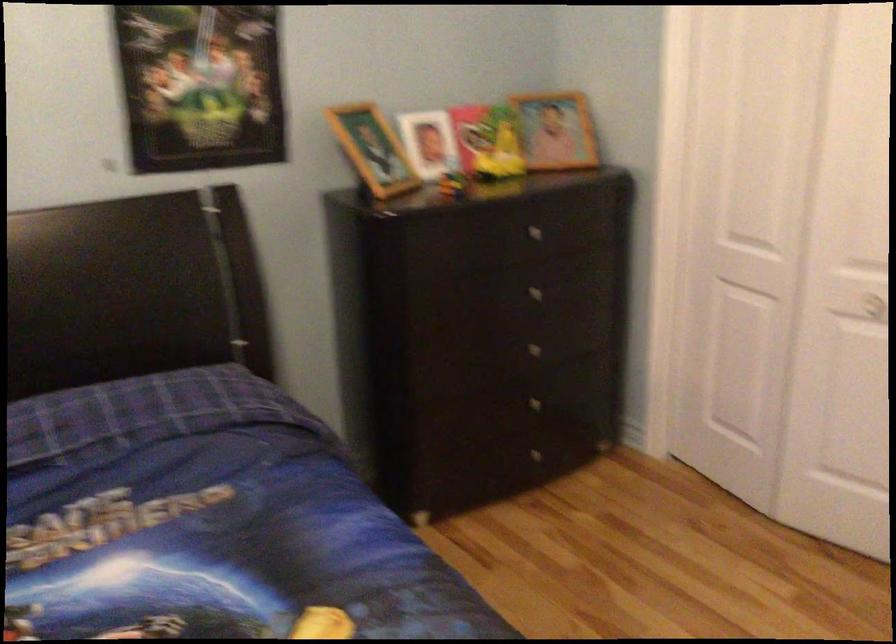
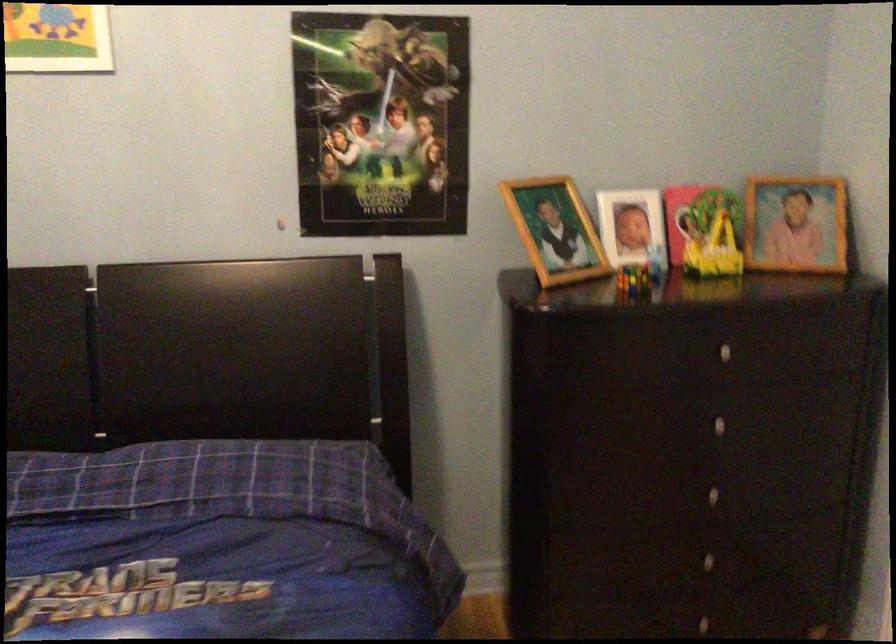
Where in the second image is the point corresponding to point 536,368 from the first image?

(711, 516)